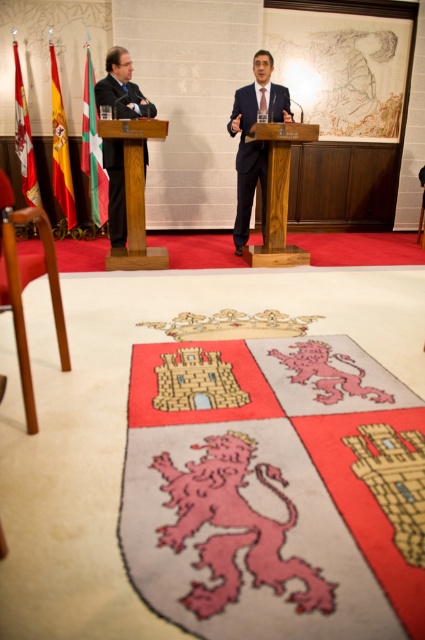
Question: Considering the real-world distances, which object is closest to the wooden podium at center?

Choices:
 (A) red fabric flag at left
 (B) matte black suit at left
 (C) green fabric flag at left

Answer: (B)

Question: Which is nearer to the matte black suit at left?

Choices:
 (A) green fabric flag at left
 (B) matte black suit at center
 (C) red fabric flag at left
 (D) silk flag at left

Answer: (B)

Question: Does matte black suit at left have a larger size compared to green fabric flag at left?

Choices:
 (A) no
 (B) yes

Answer: (B)

Question: Is matte black suit at left to the right of green fabric flag at left from the viewer's perspective?

Choices:
 (A) no
 (B) yes

Answer: (B)

Question: Does matte black suit at left appear under green fabric flag at left?

Choices:
 (A) yes
 (B) no

Answer: (A)

Question: Considering the real-world distances, which object is farthest from the wooden podium at center?

Choices:
 (A) silk flag at left
 (B) matte black suit at left
 (C) matte black suit at center
 (D) red fabric flag at left

Answer: (A)